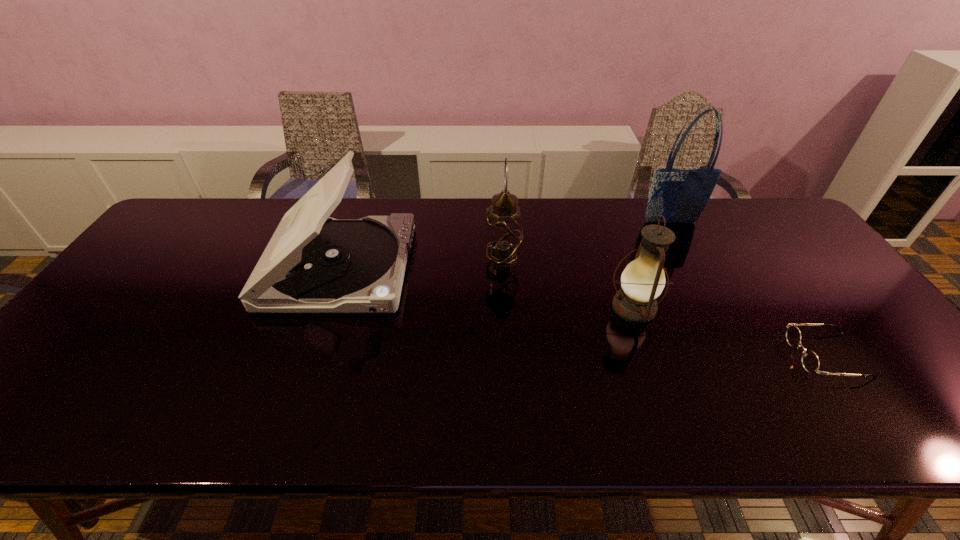
In the image, there is a desktop. Identify the location of blank space at the near edge. The width and height of the screenshot is (960, 540). (108, 416).

Identify the location of vacant space at the left edge. Image resolution: width=960 pixels, height=540 pixels. tap(159, 266).

In order to click on free space at the right edge of the desktop in this screenshot , I will do `click(890, 367)`.

In the image, there is a desktop. Identify the location of vacant space at the far right corner. pos(728,199).

I want to click on vacant space in between the shortest object and the farthest object, so click(749, 289).

Image resolution: width=960 pixels, height=540 pixels. I want to click on vacant space that is in between the farther oil lamp and the shopping bag, so click(x=587, y=242).

At what (x,y) coordinates should I click in order to perform the action: click on vacant point located between the second object from right to left and the farther oil lamp. Please return your answer as a coordinate pair (x, y). The width and height of the screenshot is (960, 540). Looking at the image, I should click on (587, 242).

Find the location of a particular element. This screenshot has height=540, width=960. free space that is in between the second object from right to left and the spectacles is located at coordinates (749, 289).

At what (x,y) coordinates should I click in order to perform the action: click on vacant area between the fourth object from right to left and the shopping bag. Please return your answer as a coordinate pair (x, y). Looking at the image, I should click on (x=587, y=242).

You are a GUI agent. You are given a task and a screenshot of the screen. Output one action in this format:
    pyautogui.click(x=<x>, y=<y>)
    Task: Click on the vacant space that's between the rightmost object and the farthest object
    
    Given the screenshot: What is the action you would take?
    click(x=749, y=289)